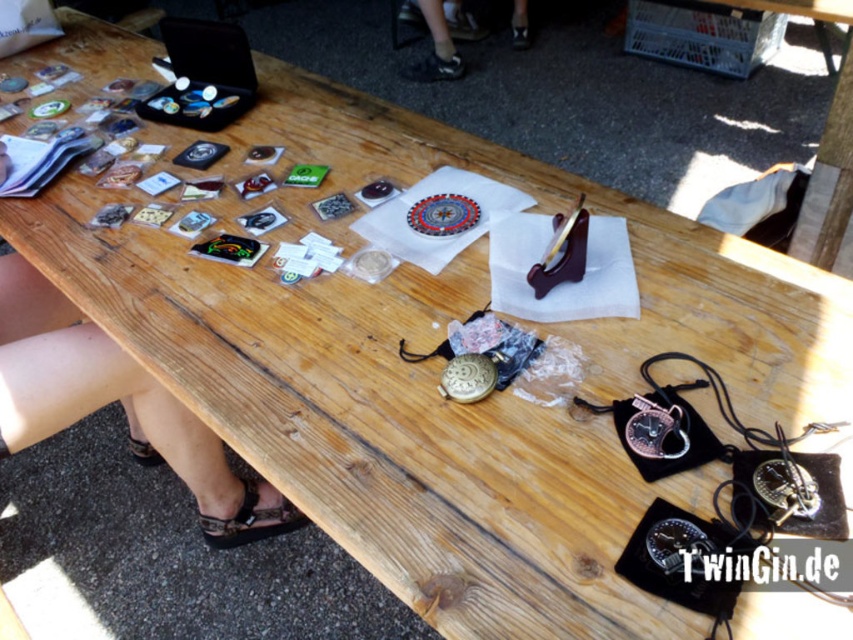
You are a customer at a flea market and see the polished silver pocket watch at lower right and the gold metallic pocket watch at center. Which one is positioned further to the right?

The polished silver pocket watch at lower right is positioned further to the right compared to the gold metallic pocket watch at center.

You are a customer at a flea market and want to buy both the polished silver pocket watch at lower right and the gold metallic pocket watch at center. The vendor says they will give you a discount if you can tell them how far apart they are. What do you tell them?

The distance between the polished silver pocket watch at lower right and the gold metallic pocket watch at center is 7.48 inches.